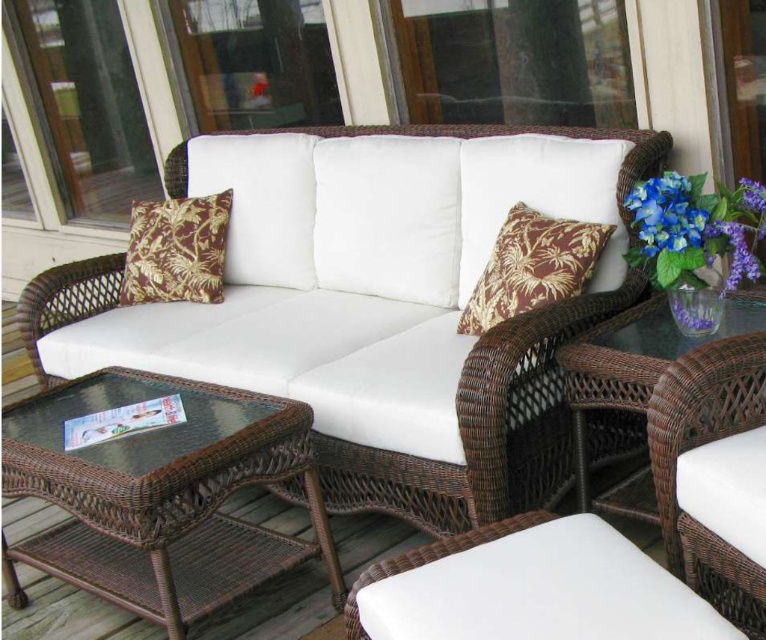
Question: Which point is closer to the camera taking this photo?

Choices:
 (A) (x=218, y=525)
 (B) (x=663, y=444)
 (C) (x=159, y=241)
 (D) (x=404, y=246)

Answer: (B)

Question: Which of the following is the farthest from the observer?

Choices:
 (A) (571, 396)
 (B) (730, 264)
 (C) (486, 273)
 (D) (701, 529)

Answer: (B)

Question: Which point appears farthest from the camera in this image?

Choices:
 (A) (218, 246)
 (B) (548, 240)

Answer: (A)

Question: Is woven rattan couch at center to the left of blue silk flowers at upper right from the viewer's perspective?

Choices:
 (A) yes
 (B) no

Answer: (A)

Question: Is brown wicker table at lower left thinner than brown textured pillow at left?

Choices:
 (A) no
 (B) yes

Answer: (A)

Question: Is woven rattan couch at center above brown wicker table at lower left?

Choices:
 (A) no
 (B) yes

Answer: (B)